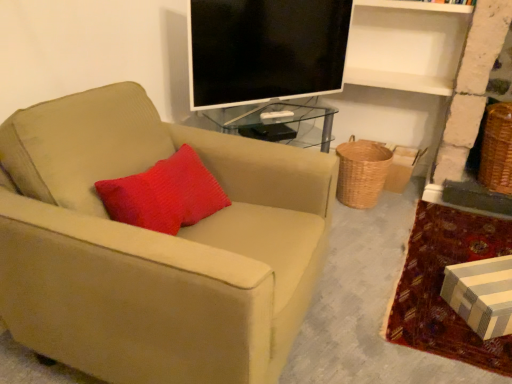
Question: Are woven brown basket at lower right, placed as the 2th basket when sorted from right to left, and black glossy tv at upper center located far from each other?

Choices:
 (A) no
 (B) yes

Answer: (A)

Question: Considering the relative sizes of woven brown basket at lower right, the first basket viewed from the left, and black glossy tv at upper center in the image provided, is woven brown basket at lower right, the first basket viewed from the left, thinner than black glossy tv at upper center?

Choices:
 (A) no
 (B) yes

Answer: (A)

Question: Does woven brown basket at lower right, placed as the 2th basket when sorted from right to left, have a larger size compared to black glossy tv at upper center?

Choices:
 (A) no
 (B) yes

Answer: (A)

Question: From the image's perspective, is woven brown basket at lower right, the first basket viewed from the left, over black glossy tv at upper center?

Choices:
 (A) yes
 (B) no

Answer: (B)

Question: Is black glossy tv at upper center surrounded by woven brown basket at lower right, the first basket viewed from the left?

Choices:
 (A) no
 (B) yes

Answer: (A)

Question: From their relative heights in the image, would you say brown woven basket at lower right, the second basket viewed from the left, is taller or shorter than suede beige armchair at left?

Choices:
 (A) short
 (B) tall

Answer: (A)

Question: Looking at their shapes, would you say brown woven basket at lower right, positioned as the first basket in right-to-left order, is wider or thinner than suede beige armchair at left?

Choices:
 (A) wide
 (B) thin

Answer: (B)

Question: Is point (487, 187) positioned closer to the camera than point (306, 235)?

Choices:
 (A) farther
 (B) closer

Answer: (A)

Question: Is brown woven basket at lower right, positioned as the first basket in right-to-left order, inside the boundaries of suede beige armchair at left, or outside?

Choices:
 (A) inside
 (B) outside

Answer: (B)

Question: Considering the positions of point (498, 155) and point (368, 205), is point (498, 155) closer or farther from the camera than point (368, 205)?

Choices:
 (A) farther
 (B) closer

Answer: (B)

Question: Considering the relative positions of brown woven basket at lower right, the second basket viewed from the left, and woven brown basket at lower right, placed as the 2th basket when sorted from right to left, in the image provided, is brown woven basket at lower right, the second basket viewed from the left, to the left or to the right of woven brown basket at lower right, placed as the 2th basket when sorted from right to left,?

Choices:
 (A) right
 (B) left

Answer: (A)

Question: In terms of height, does brown woven basket at lower right, the second basket viewed from the left, look taller or shorter compared to woven brown basket at lower right, the first basket viewed from the left?

Choices:
 (A) short
 (B) tall

Answer: (B)

Question: Based on their sizes in the image, would you say brown woven basket at lower right, the second basket viewed from the left, is bigger or smaller than woven brown basket at lower right, the first basket viewed from the left?

Choices:
 (A) big
 (B) small

Answer: (A)

Question: Considering their positions, is black glossy tv at upper center located in front of or behind suede beige armchair at left?

Choices:
 (A) front
 (B) behind

Answer: (B)

Question: Does point (306, 69) appear closer or farther from the camera than point (274, 349)?

Choices:
 (A) closer
 (B) farther

Answer: (B)